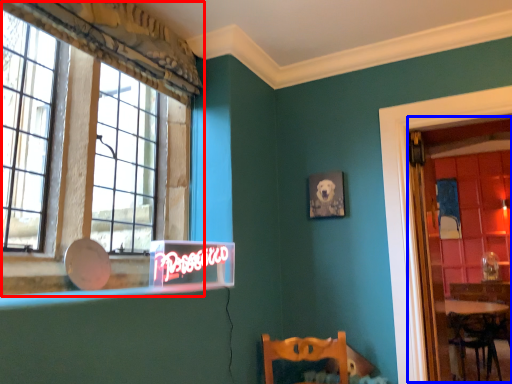
Question: Among these objects, which one is farthest to the camera, window (highlighted by a red box) or glass door (highlighted by a blue box)?

Choices:
 (A) window
 (B) glass door

Answer: (B)